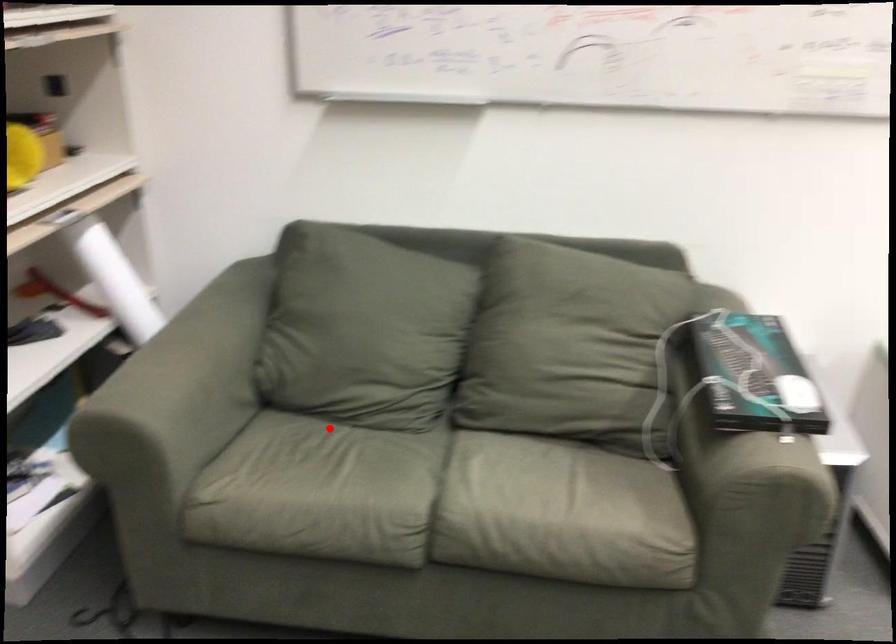
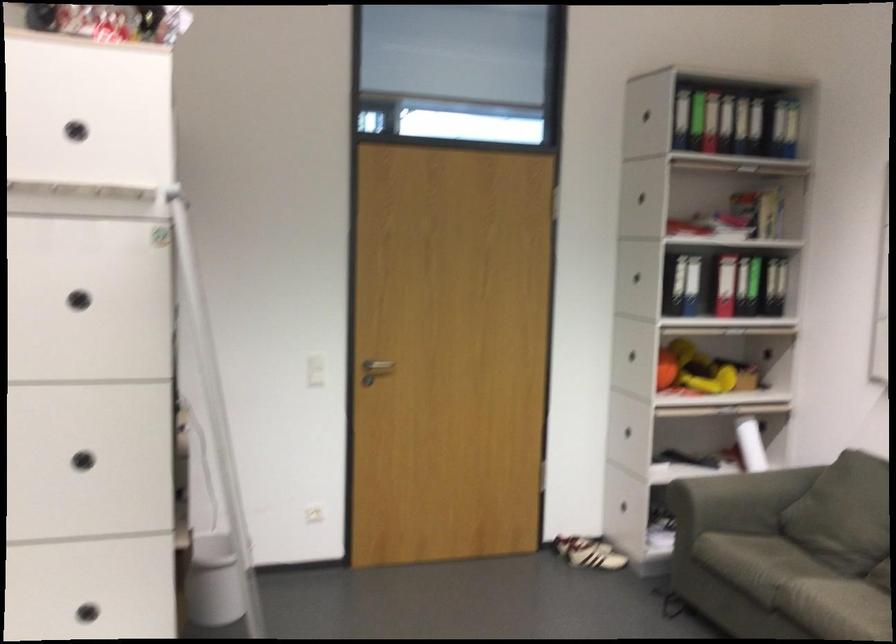
Question: I am providing you with two images of the same scene from different viewpoints. In image1, a red point is highlighted. Considering the same 3D point in image2, which of the following is correct?

Choices:
 (A) It is closer
 (B) It is farther

Answer: (B)